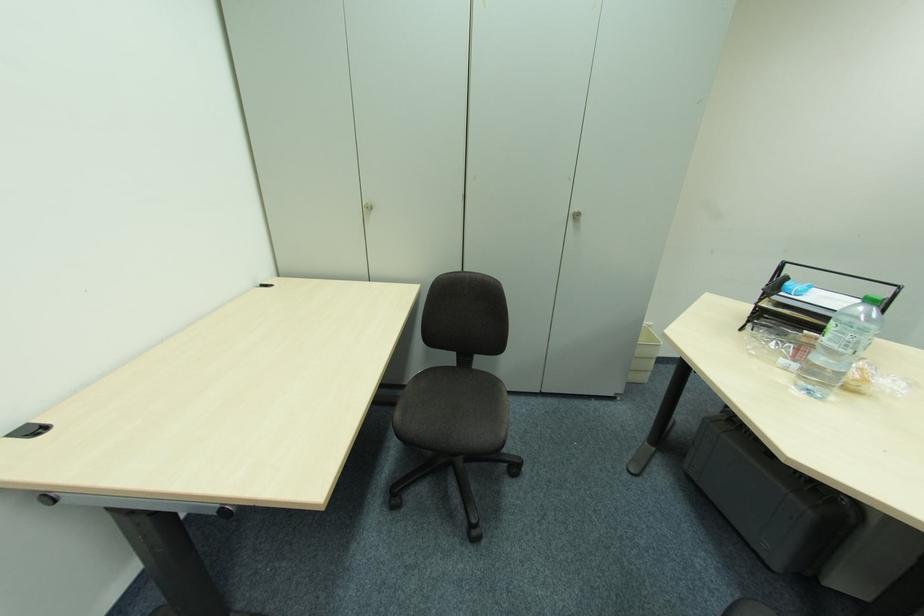
The image size is (924, 616). I want to click on green bottle cap, so click(839, 347).